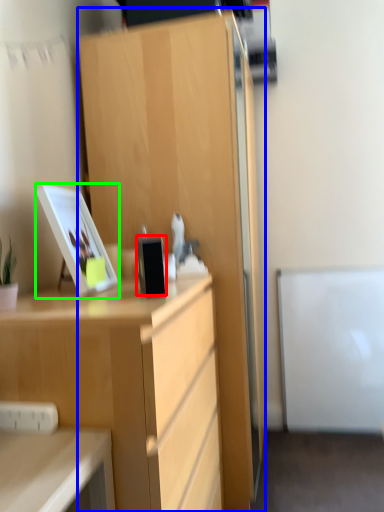
Question: Which object is the closest to the appliance (highlighted by a red box)? Choose among these: cabinetry (highlighted by a blue box) or picture frame (highlighted by a green box).

Choices:
 (A) cabinetry
 (B) picture frame

Answer: (B)